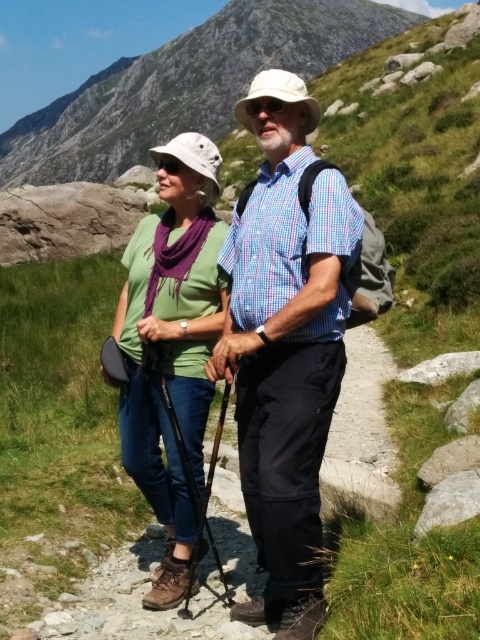
Question: Among these objects, which one is farthest from the camera?

Choices:
 (A) matte blue shirt at center
 (B) granite rock at upper center
 (C) green matte shirt at center

Answer: (B)

Question: Which of these objects is positioned farthest from the granite rock at upper center?

Choices:
 (A) green matte shirt at center
 (B) matte blue shirt at center

Answer: (B)

Question: Which point is farther from the camera taking this photo?

Choices:
 (A) (406, 26)
 (B) (140, 371)

Answer: (A)

Question: Considering the relative positions of granite rock at upper center and green matte shirt at center in the image provided, where is granite rock at upper center located with respect to green matte shirt at center?

Choices:
 (A) above
 (B) below

Answer: (A)

Question: Does matte blue shirt at center appear under granite rock at upper center?

Choices:
 (A) yes
 (B) no

Answer: (A)

Question: Can you confirm if matte blue shirt at center is smaller than green matte shirt at center?

Choices:
 (A) yes
 (B) no

Answer: (A)